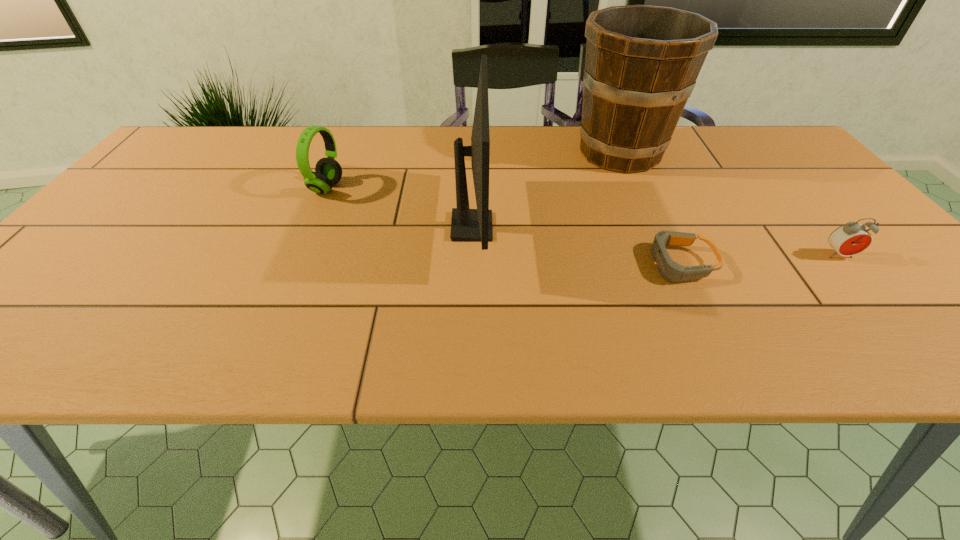
Locate an element on the screen. free space located on the face of the second shortest object is located at coordinates (894, 320).

Find the location of a particular element. This screenshot has width=960, height=540. vacant space located on the front and back of the goggles is located at coordinates (593, 264).

The height and width of the screenshot is (540, 960). I want to click on free space located on the front and back of the goggles, so click(x=532, y=264).

Where is `free point located 0.060m on the front and back of the goggles`? The height and width of the screenshot is (540, 960). free point located 0.060m on the front and back of the goggles is located at coordinates (617, 264).

The width and height of the screenshot is (960, 540). I want to click on object situated at the far edge, so click(642, 62).

The height and width of the screenshot is (540, 960). Find the location of `object present at the right edge`. object present at the right edge is located at coordinates (850, 239).

This screenshot has height=540, width=960. In the image, there is a desktop. Identify the location of vacant space at the far edge. (350, 141).

In the image, there is a desktop. Where is `vacant space at the near edge`? Image resolution: width=960 pixels, height=540 pixels. vacant space at the near edge is located at coordinates (852, 326).

At what (x,y) coordinates should I click in order to perform the action: click on blank space at the left edge of the desktop. Please return your answer as a coordinate pair (x, y). The width and height of the screenshot is (960, 540). Looking at the image, I should click on (47, 321).

Image resolution: width=960 pixels, height=540 pixels. Find the location of `vacant region at the far left corner`. vacant region at the far left corner is located at coordinates (182, 151).